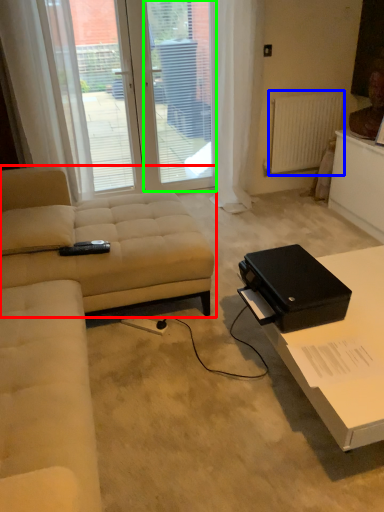
Question: Which object is positioned closest to studio couch (highlighted by a red box)? Select from radiator (highlighted by a blue box) and screen door (highlighted by a green box).

Choices:
 (A) radiator
 (B) screen door

Answer: (B)